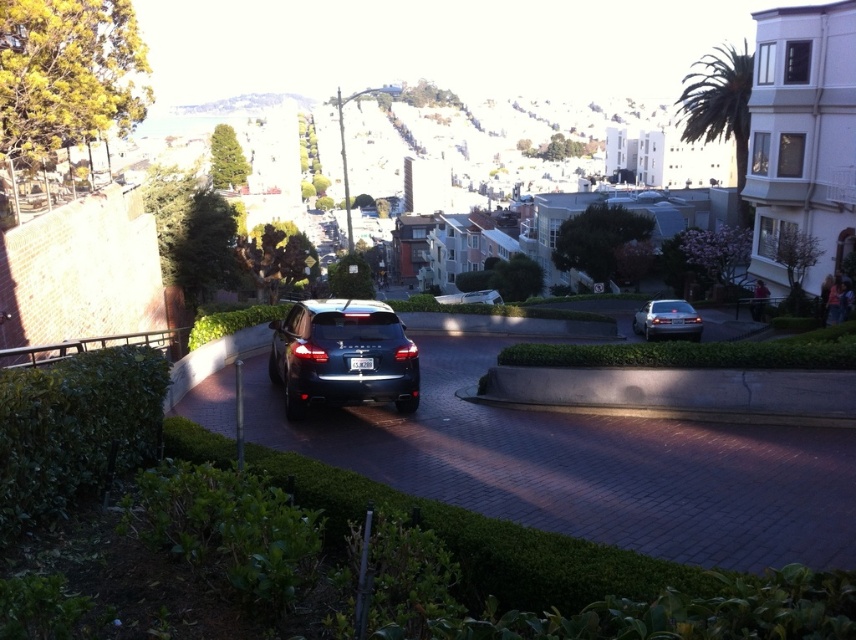
Is satin black sedan at center above satin silver sedan at center?

Incorrect, satin black sedan at center is not positioned above satin silver sedan at center.

Does satin black sedan at center have a lesser width compared to satin silver sedan at center?

Incorrect, satin black sedan at center's width is not less than satin silver sedan at center's.

Based on the photo, who is more forward, (385, 326) or (687, 323)?

Point (385, 326) is in front.

Find the location of a particular element. satin black sedan at center is located at coordinates (342, 355).

How far apart are white concrete buildings at upper center and white plastic license plate at center?

They are 1238.38 feet apart.

Is point (455, 109) positioned before point (349, 369)?

No, (455, 109) is further to viewer.

Where is `white concrete buildings at upper center`? This screenshot has width=856, height=640. white concrete buildings at upper center is located at coordinates (550, 141).

Measure the distance between point (611, 138) and camera.

272.30 meters

Can you confirm if white concrete buildings at upper center is positioned to the right of satin silver sedan at center?

Yes, white concrete buildings at upper center is to the right of satin silver sedan at center.

The image size is (856, 640). Describe the element at coordinates (550, 141) in the screenshot. I see `white concrete buildings at upper center` at that location.

You are a GUI agent. You are given a task and a screenshot of the screen. Output one action in this format:
    pyautogui.click(x=<x>, y=<y>)
    Task: Click on the white concrete buildings at upper center
    Image resolution: width=856 pixels, height=640 pixels.
    Given the screenshot: What is the action you would take?
    pyautogui.click(x=550, y=141)